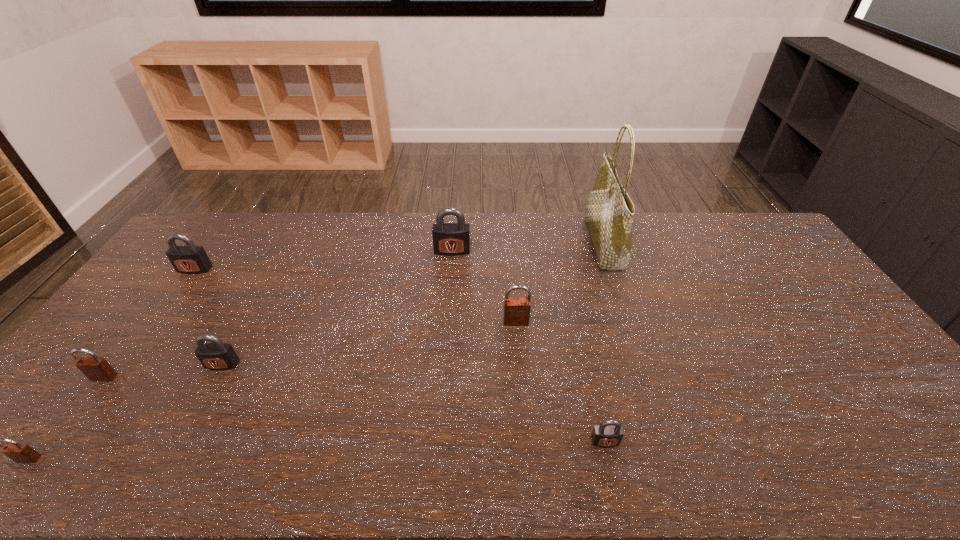
This screenshot has height=540, width=960. I want to click on green shopping bag, so click(609, 212).

Find the location of `shopping bag`. shopping bag is located at coordinates (609, 212).

Find the location of a particular element. The height and width of the screenshot is (540, 960). the third padlock from right to left is located at coordinates (449, 239).

Image resolution: width=960 pixels, height=540 pixels. What are the coordinates of `the farthest padlock` in the screenshot? It's located at (449, 239).

Locate an element on the screen. Image resolution: width=960 pixels, height=540 pixels. the second biggest gray padlock is located at coordinates (187, 259).

Where is `the third nearest gray padlock`? The width and height of the screenshot is (960, 540). the third nearest gray padlock is located at coordinates (187, 259).

This screenshot has width=960, height=540. In order to click on the rightmost brown padlock in this screenshot , I will do `click(516, 310)`.

In order to click on the second padlock from right to left in this screenshot , I will do `click(516, 310)`.

Where is `the second smallest brown padlock`? The image size is (960, 540). the second smallest brown padlock is located at coordinates (96, 369).

Where is `the third nearest object`? This screenshot has height=540, width=960. the third nearest object is located at coordinates (96, 369).